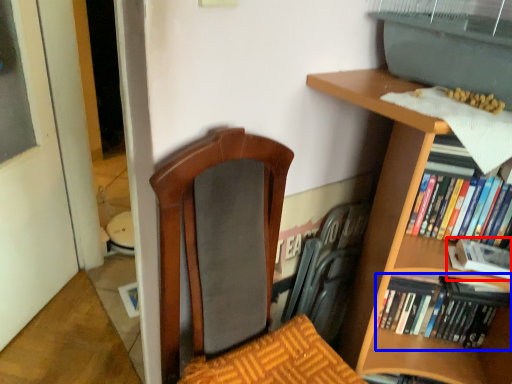
Question: Which of the following is the closest to the observer, book (highlighted by a red box) or book (highlighted by a blue box)?

Choices:
 (A) book
 (B) book

Answer: (A)